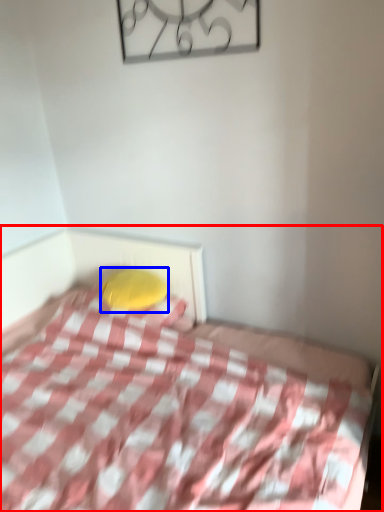
Question: Which point is closer to the camera, bed (highlighted by a red box) or pillow (highlighted by a blue box)?

Choices:
 (A) bed
 (B) pillow

Answer: (A)